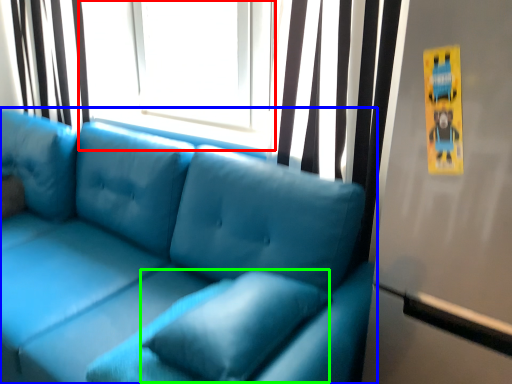
Question: Which object is the farthest from window screen (highlighted by a red box)? Choose among these: studio couch (highlighted by a blue box) or pillow (highlighted by a green box).

Choices:
 (A) studio couch
 (B) pillow

Answer: (B)